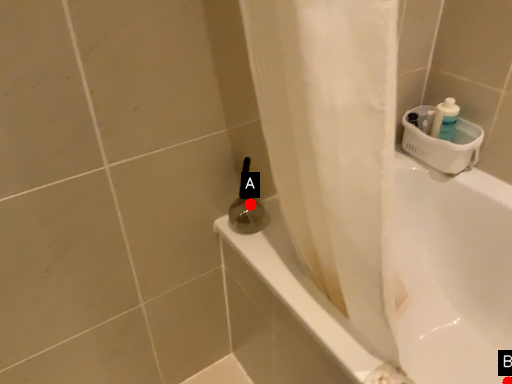
Question: Two points are circled on the image, labeled by A and B beside each circle. Which of the following is the closest to the observer?

Choices:
 (A) A is closer
 (B) B is closer

Answer: (A)